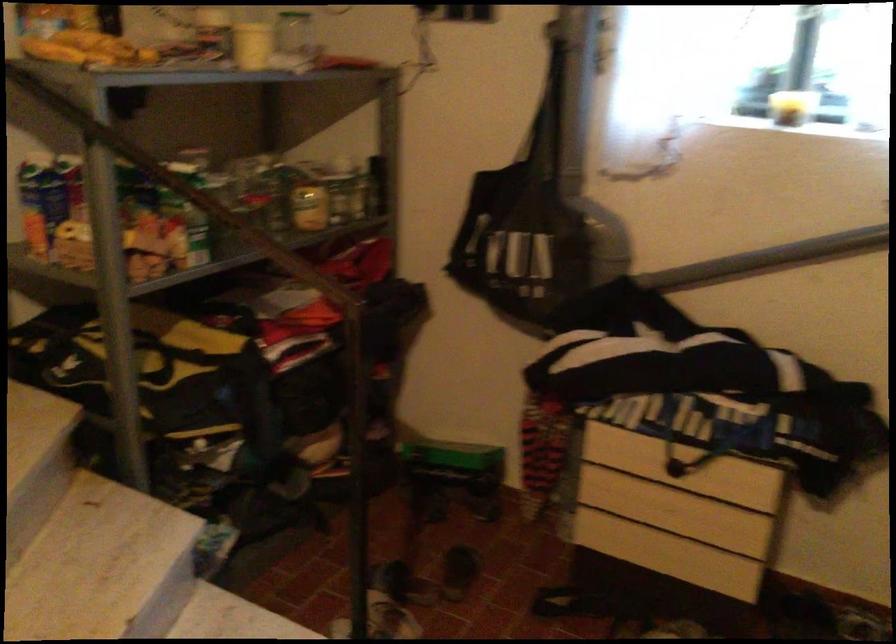
Image resolution: width=896 pixels, height=644 pixels. Describe the element at coordinates (526, 223) in the screenshot. I see `a black bag strap` at that location.